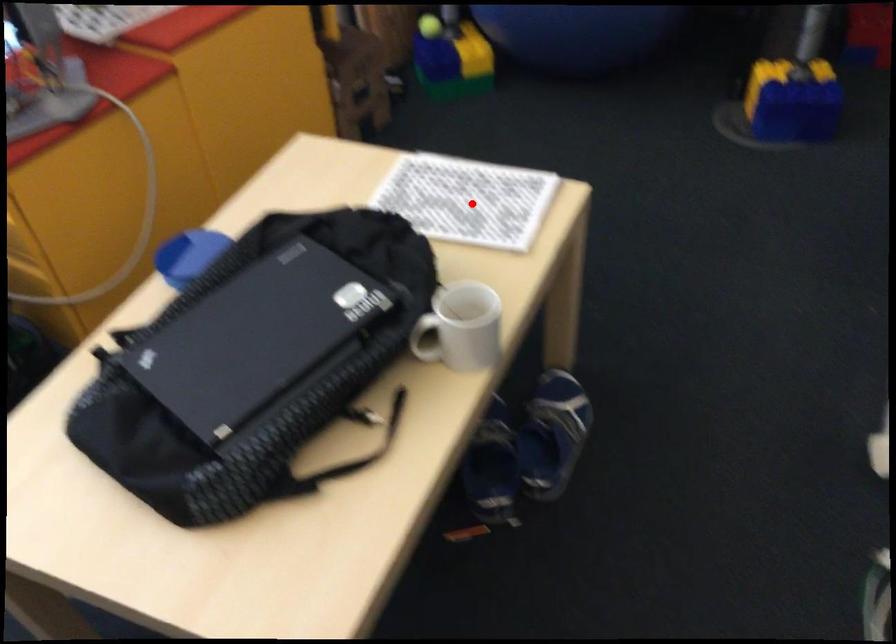
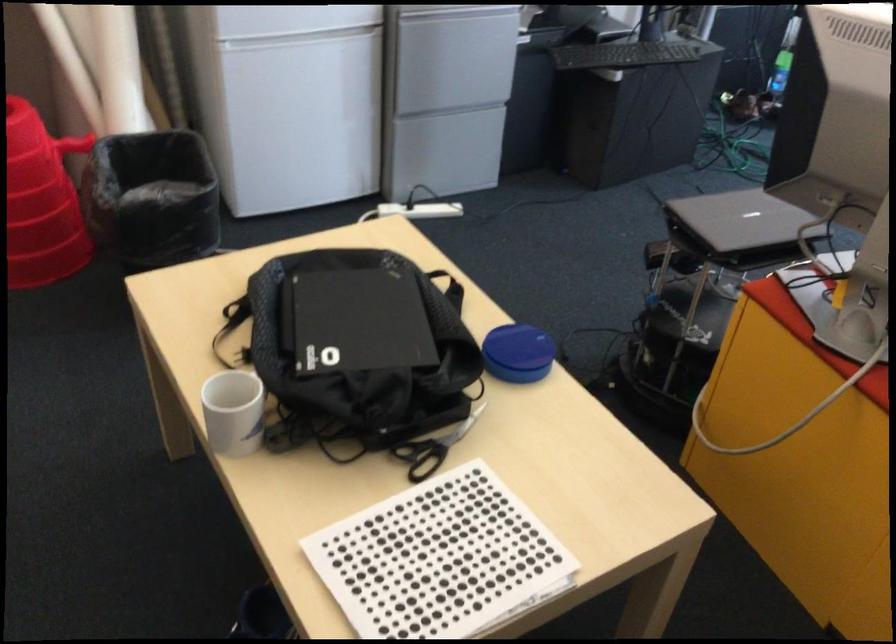
Question: I am providing you with two images of the same scene from different viewpoints. Given a red point in image1, look at the same physical point in image2. Is it:

Choices:
 (A) Closer to the viewpoint
 (B) Farther from the viewpoint

Answer: (A)